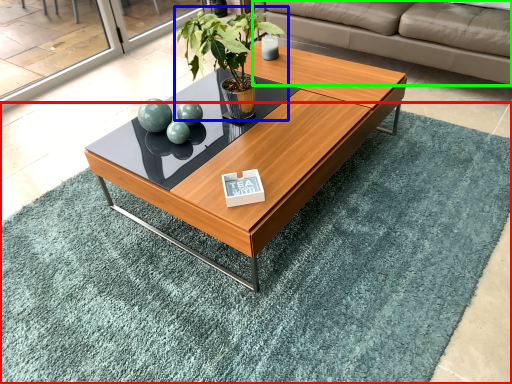
Question: Estimate the real-world distances between objects in this image. Which object is closer to mat (highlighted by a red box), houseplant (highlighted by a blue box) or studio couch (highlighted by a green box)?

Choices:
 (A) houseplant
 (B) studio couch

Answer: (A)